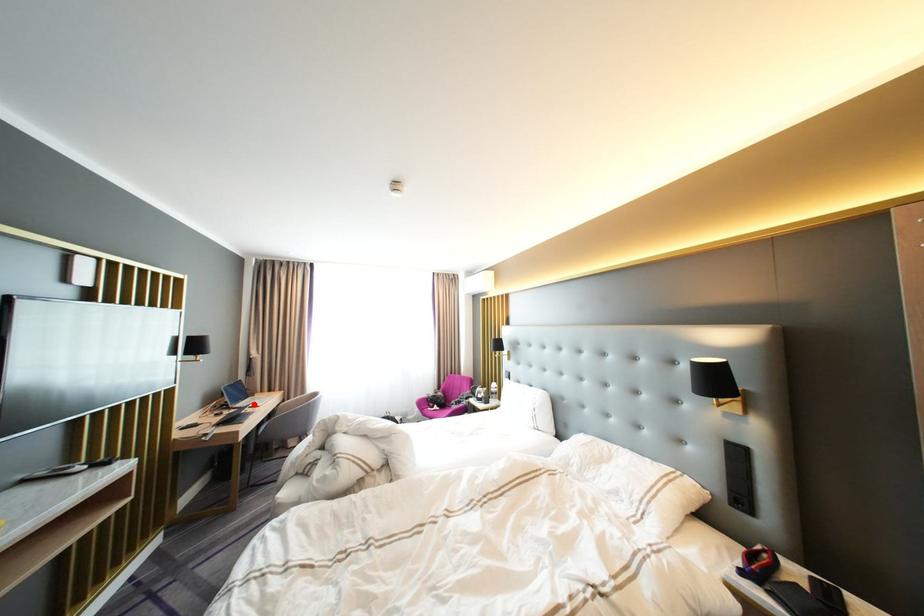
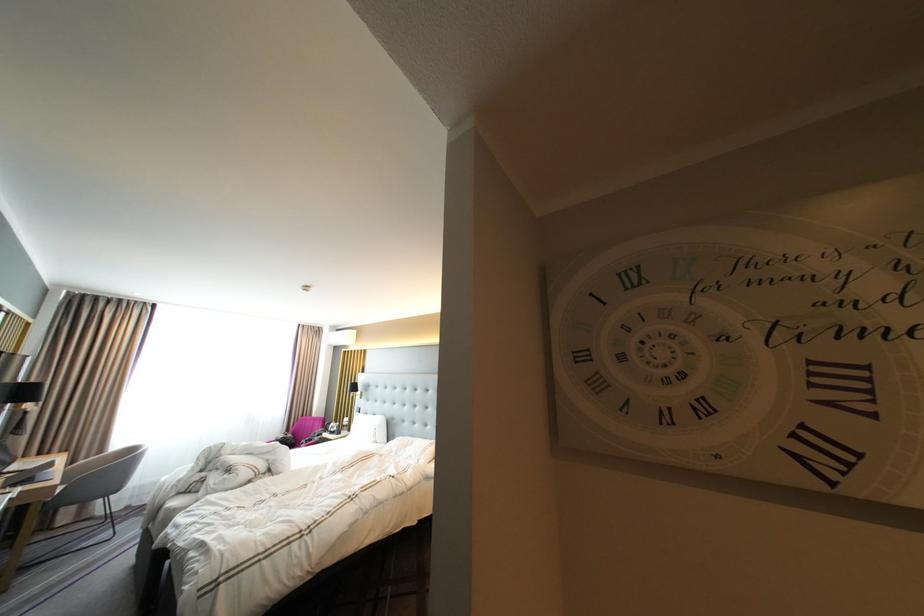
Where in the second image is the point corresponding to the highlighted location from the first image?

(27, 468)